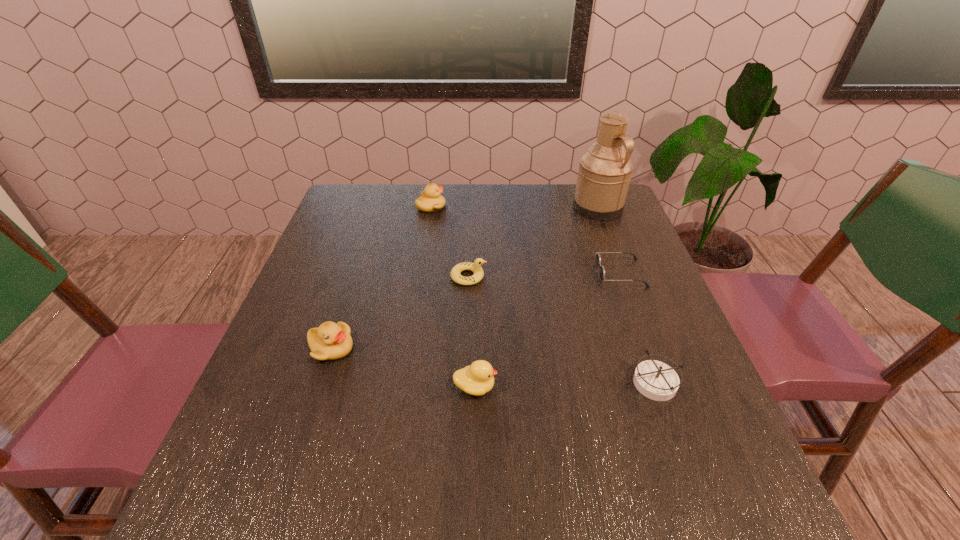
In order to click on the closest duckling to the third duckling from right to left in this screenshot , I will do `click(476, 267)`.

Choose which duckling is the third nearest neighbor to the nearest duckling. Please provide its 2D coordinates. Your answer should be formatted as a tuple, i.e. [(x, y)], where the tuple contains the x and y coordinates of a point satisfying the conditions above.

[(430, 200)]

Locate an element on the screen. This screenshot has width=960, height=540. vacant space that satisfies the following two spatial constraints: 1. on the front side of the pitcher; 2. on the beak of the nearest duckling is located at coordinates (665, 387).

Image resolution: width=960 pixels, height=540 pixels. I want to click on free space that satisfies the following two spatial constraints: 1. on the beak of the tallest object; 2. on the left side of the second object from left to right, so click(431, 207).

Identify the location of free space in the image that satisfies the following two spatial constraints: 1. on the beak of the sixth object from right to left; 2. on the left side of the tallest object. (431, 207).

Locate an element on the screen. This screenshot has height=540, width=960. free spot that satisfies the following two spatial constraints: 1. on the beak of the second duckling from left to right; 2. on the back side of the pitcher is located at coordinates (431, 207).

Where is `vacant area that satisfies the following two spatial constraints: 1. on the face of the compass; 2. on the right side of the shortest duckling`? vacant area that satisfies the following two spatial constraints: 1. on the face of the compass; 2. on the right side of the shortest duckling is located at coordinates (466, 382).

Find the location of a particular element. The width and height of the screenshot is (960, 540). vacant area in the image that satisfies the following two spatial constraints: 1. on the beak of the third duckling from right to left; 2. on the left side of the compass is located at coordinates (403, 382).